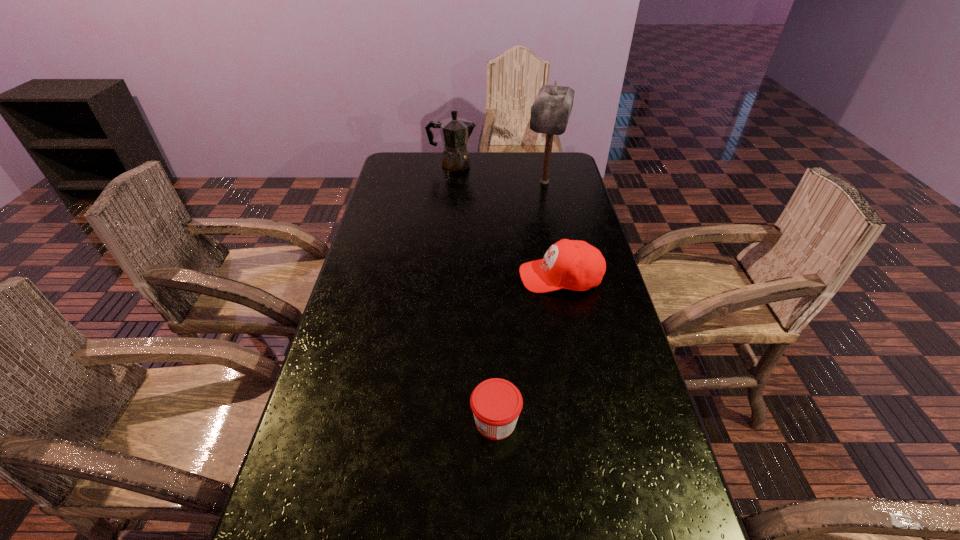
This screenshot has width=960, height=540. I want to click on mallet, so click(x=550, y=112).

Find the location of a particular element. Image resolution: width=960 pixels, height=540 pixels. coffeepot is located at coordinates (455, 132).

Locate an element on the screen. baseball cap is located at coordinates (576, 265).

Find the location of a particular element. the second nearest object is located at coordinates (576, 265).

Find the location of a particular element. the shortest object is located at coordinates point(496,403).

I want to click on the nearest object, so click(x=496, y=403).

At what (x,y) coordinates should I click in order to perform the action: click on vacant space located 0.100m on the left of the tallest object. Please return your answer as a coordinate pair (x, y). Looking at the image, I should click on (497, 182).

This screenshot has width=960, height=540. I want to click on blank area located on the pouring side of the second tallest object, so click(554, 165).

Locate an element on the screen. The width and height of the screenshot is (960, 540). free point located 0.240m on the front panel of the third tallest object is located at coordinates (439, 277).

Where is `vacant space positioned on the front panel of the third tallest object`? The width and height of the screenshot is (960, 540). vacant space positioned on the front panel of the third tallest object is located at coordinates (482, 277).